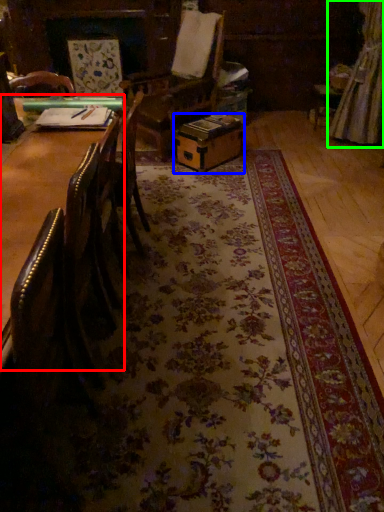
Question: Which is nearer to the table (highlighted by a red box)? cardboard box (highlighted by a blue box) or curtain (highlighted by a green box).

Choices:
 (A) cardboard box
 (B) curtain

Answer: (A)